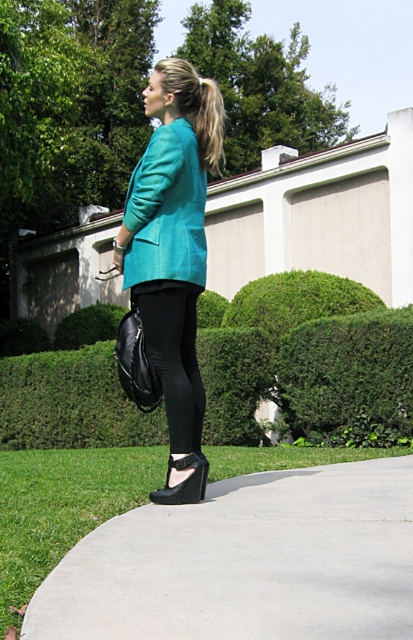
Question: Which point appears closest to the camera in this image?

Choices:
 (A) (227, 420)
 (B) (187, 188)
 (C) (187, 348)

Answer: (B)

Question: Which of the following is the closest to the observer?

Choices:
 (A) (201, 148)
 (B) (343, 468)
 (C) (196, 292)
 (D) (291, 380)

Answer: (C)

Question: Is teal fabric blazer at center to the right of black smooth leggings at center from the viewer's perspective?

Choices:
 (A) yes
 (B) no

Answer: (B)

Question: Which point is farther from the camera taking this photo?

Choices:
 (A) (215, 632)
 (B) (116, 388)
 (C) (222, 100)
 (D) (170, 396)

Answer: (B)

Question: Does green leafy hedge at center lie in front of blonde hair at upper center?

Choices:
 (A) no
 (B) yes

Answer: (A)

Question: Can you confirm if teal fabric jacket at center is thinner than black smooth leggings at center?

Choices:
 (A) yes
 (B) no

Answer: (A)